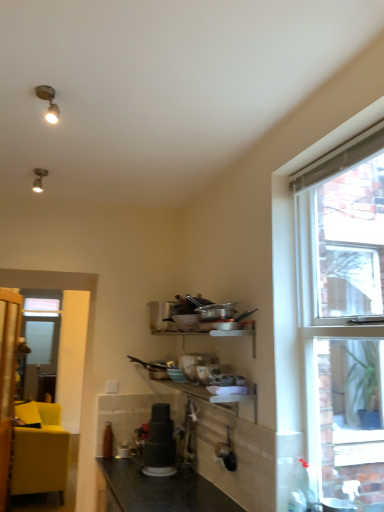
Question: Does black granite countertop at lower center have a lesser height compared to matte black blender at center?

Choices:
 (A) yes
 (B) no

Answer: (A)

Question: From a real-world perspective, is black granite countertop at lower center on top of matte black blender at center?

Choices:
 (A) yes
 (B) no

Answer: (B)

Question: Is black granite countertop at lower center not close to matte black blender at center?

Choices:
 (A) yes
 (B) no

Answer: (B)

Question: Is black granite countertop at lower center positioned beyond the bounds of matte black blender at center?

Choices:
 (A) no
 (B) yes

Answer: (B)

Question: Is matte black blender at center completely or partially inside black granite countertop at lower center?

Choices:
 (A) yes
 (B) no

Answer: (B)

Question: Is matte black blender at center taller or shorter than black granite countertop at lower center?

Choices:
 (A) short
 (B) tall

Answer: (B)

Question: Is matte black blender at center in front of or behind black granite countertop at lower center in the image?

Choices:
 (A) front
 (B) behind

Answer: (B)

Question: From a real-world perspective, is matte black blender at center positioned above or below black granite countertop at lower center?

Choices:
 (A) above
 (B) below

Answer: (A)

Question: Does point (162, 430) appear closer or farther from the camera than point (153, 502)?

Choices:
 (A) closer
 (B) farther

Answer: (B)

Question: From their relative heights in the image, would you say clear glass window at upper right is taller or shorter than matte black blender at center?

Choices:
 (A) short
 (B) tall

Answer: (B)

Question: Is clear glass window at upper right wider or thinner than matte black blender at center?

Choices:
 (A) wide
 (B) thin

Answer: (A)

Question: Is clear glass window at upper right in front of or behind matte black blender at center in the image?

Choices:
 (A) behind
 (B) front

Answer: (B)

Question: From a real-world perspective, is clear glass window at upper right physically located above or below matte black blender at center?

Choices:
 (A) above
 (B) below

Answer: (A)

Question: Is matte yellow couch at left inside the boundaries of clear glass window at upper right, or outside?

Choices:
 (A) outside
 (B) inside

Answer: (A)

Question: Visually, is matte yellow couch at left positioned to the left or to the right of clear glass window at upper right?

Choices:
 (A) left
 (B) right

Answer: (A)